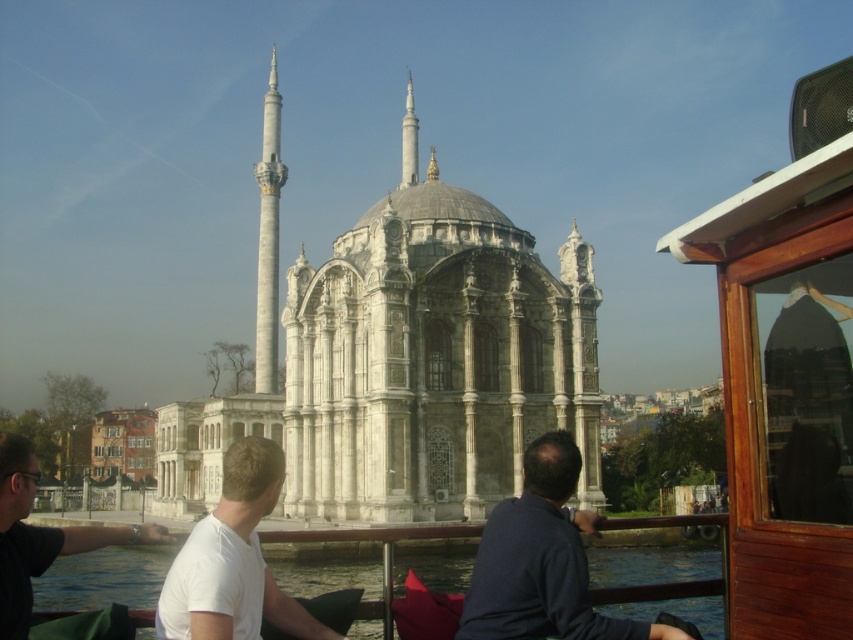
Question: Which object is farther from the camera taking this photo?

Choices:
 (A) blue water at lower left
 (B) white matte shirt at lower left
 (C) dark blue sweater at center

Answer: (A)

Question: Can you confirm if blue water at lower left is positioned to the left of white matte shirt at center?

Choices:
 (A) yes
 (B) no

Answer: (B)

Question: Which point is farther from the camera taking this photo?

Choices:
 (A) (198, 627)
 (B) (555, 609)
 (C) (616, 586)
 (D) (24, 499)

Answer: (C)

Question: Which point is farther from the camera taking this photo?

Choices:
 (A) (352, 632)
 (B) (27, 512)
 (C) (491, 621)
 (D) (271, 600)

Answer: (A)

Question: Can you confirm if white matte shirt at center is thinner than white matte shirt at lower left?

Choices:
 (A) no
 (B) yes

Answer: (A)

Question: Can you confirm if dark blue sweater at center is positioned to the right of white matte shirt at lower left?

Choices:
 (A) yes
 (B) no

Answer: (A)